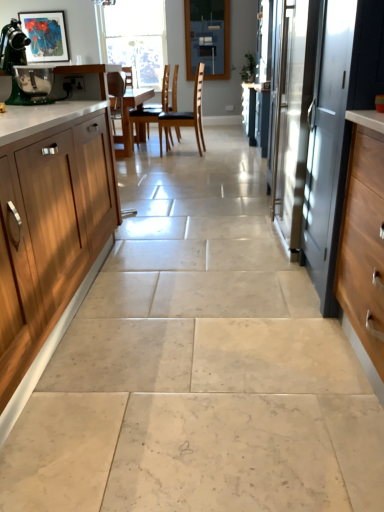
Question: From the image's perspective, does satin silver screen door at right appear lower than blue glass window screen at upper center?

Choices:
 (A) yes
 (B) no

Answer: (A)

Question: Is satin silver screen door at right beside blue glass window screen at upper center?

Choices:
 (A) no
 (B) yes

Answer: (A)

Question: From the image's perspective, is satin silver screen door at right over blue glass window screen at upper center?

Choices:
 (A) no
 (B) yes

Answer: (A)

Question: Is satin silver screen door at right further to camera compared to blue glass window screen at upper center?

Choices:
 (A) no
 (B) yes

Answer: (A)

Question: Does satin silver screen door at right turn towards blue glass window screen at upper center?

Choices:
 (A) yes
 (B) no

Answer: (B)

Question: In terms of size, does wooden cabinet at left appear bigger or smaller than satin silver screen door at right?

Choices:
 (A) small
 (B) big

Answer: (B)

Question: Considering the relative positions of wooden cabinet at left and satin silver screen door at right in the image provided, is wooden cabinet at left to the left or to the right of satin silver screen door at right?

Choices:
 (A) left
 (B) right

Answer: (A)

Question: Which is correct: wooden cabinet at left is inside satin silver screen door at right, or outside of it?

Choices:
 (A) outside
 (B) inside

Answer: (A)

Question: In the image, is wooden cabinet at left positioned in front of or behind satin silver screen door at right?

Choices:
 (A) front
 (B) behind

Answer: (A)

Question: Relative to matte acrylic painting at upper left, is green matte coffee machine at upper left in front or behind?

Choices:
 (A) behind
 (B) front

Answer: (B)

Question: From the image's perspective, is green matte coffee machine at upper left located above or below matte acrylic painting at upper left?

Choices:
 (A) above
 (B) below

Answer: (B)

Question: From a real-world perspective, relative to matte acrylic painting at upper left, is green matte coffee machine at upper left vertically above or below?

Choices:
 (A) below
 (B) above

Answer: (A)

Question: Is green matte coffee machine at upper left wider or thinner than matte acrylic painting at upper left?

Choices:
 (A) thin
 (B) wide

Answer: (B)

Question: Relative to black leather chair at center, placed as the 2th chair when sorted from left to right, is green matte coffee machine at upper left in front or behind?

Choices:
 (A) front
 (B) behind

Answer: (A)

Question: Is green matte coffee machine at upper left taller or shorter than black leather chair at center, placed as the 2th chair when sorted from left to right?

Choices:
 (A) tall
 (B) short

Answer: (B)